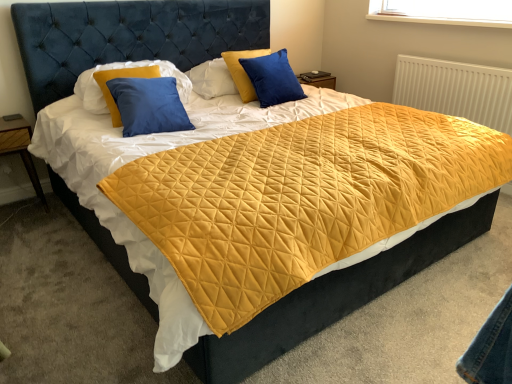
Identify the location of vacant area that is situated to the right of wooden at left. (55, 211).